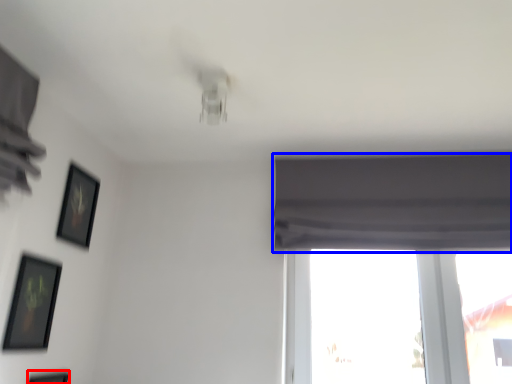
Question: Which point is closer to the camera, picture frame (highlighted by a red box) or curtain (highlighted by a blue box)?

Choices:
 (A) picture frame
 (B) curtain

Answer: (A)